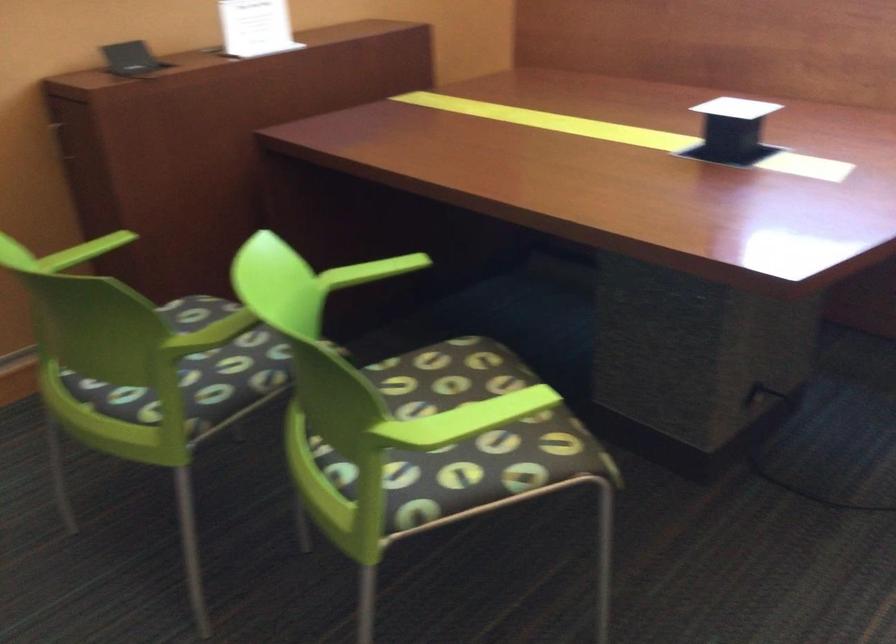
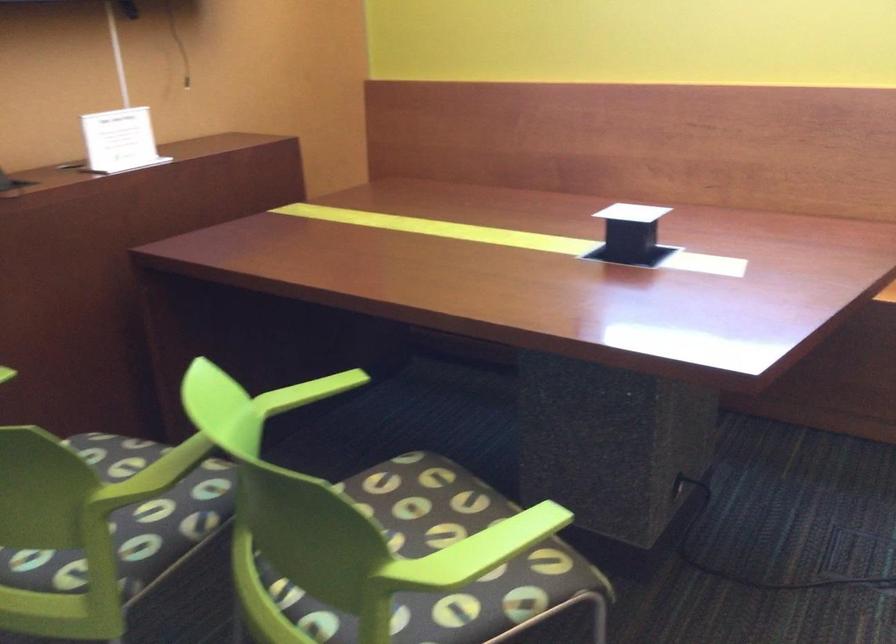
Find the pixel in the second image that matches (454,366) in the first image.

(403, 487)